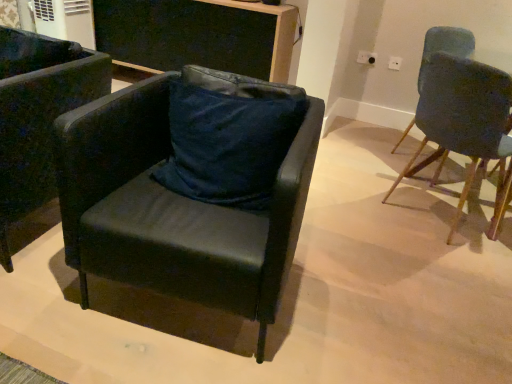
Question: Does dark blue fabric pillow at center have a lesser width compared to black matte desk at upper center?

Choices:
 (A) no
 (B) yes

Answer: (B)

Question: Is black matte desk at upper center completely or partially inside dark blue fabric pillow at center?

Choices:
 (A) yes
 (B) no

Answer: (B)

Question: From the image's perspective, does dark blue fabric pillow at center appear lower than black matte desk at upper center?

Choices:
 (A) yes
 (B) no

Answer: (A)

Question: Is dark blue fabric pillow at center taller than black matte desk at upper center?

Choices:
 (A) no
 (B) yes

Answer: (A)

Question: Is dark blue fabric pillow at center wider than black matte desk at upper center?

Choices:
 (A) no
 (B) yes

Answer: (A)

Question: Can you confirm if dark blue fabric pillow at center is bigger than black matte desk at upper center?

Choices:
 (A) yes
 (B) no

Answer: (B)

Question: From a real-world perspective, is white plastic power outlet at upper right, which appears as the 1th power outlet when viewed from the right, located beneath black leather chair at center, which is the 2th chair in right-to-left order?

Choices:
 (A) no
 (B) yes

Answer: (A)

Question: From a real-world perspective, is white plastic power outlet at upper right, the 2th power outlet viewed from the left, over black leather chair at center, arranged as the 2th chair when viewed from the left?

Choices:
 (A) no
 (B) yes

Answer: (B)

Question: Does white plastic power outlet at upper right, which appears as the 1th power outlet when viewed from the right, appear on the left side of black leather chair at center, which is the 2th chair in right-to-left order?

Choices:
 (A) yes
 (B) no

Answer: (B)

Question: Would you say white plastic power outlet at upper right, which appears as the 1th power outlet when viewed from the right, is a long distance from black leather chair at center, arranged as the 2th chair when viewed from the left?

Choices:
 (A) yes
 (B) no

Answer: (A)

Question: Does white plastic power outlet at upper right, which appears as the 1th power outlet when viewed from the right, come in front of black leather chair at center, arranged as the 2th chair when viewed from the left?

Choices:
 (A) no
 (B) yes

Answer: (A)

Question: Is the surface of white plastic power outlet at upper right, the 2th power outlet viewed from the left, in direct contact with black leather chair at center, which is the 2th chair in right-to-left order?

Choices:
 (A) yes
 (B) no

Answer: (B)

Question: Are dark blue fabric pillow at center and black leather chair at center, arranged as the 2th chair when viewed from the left, located far from each other?

Choices:
 (A) no
 (B) yes

Answer: (A)